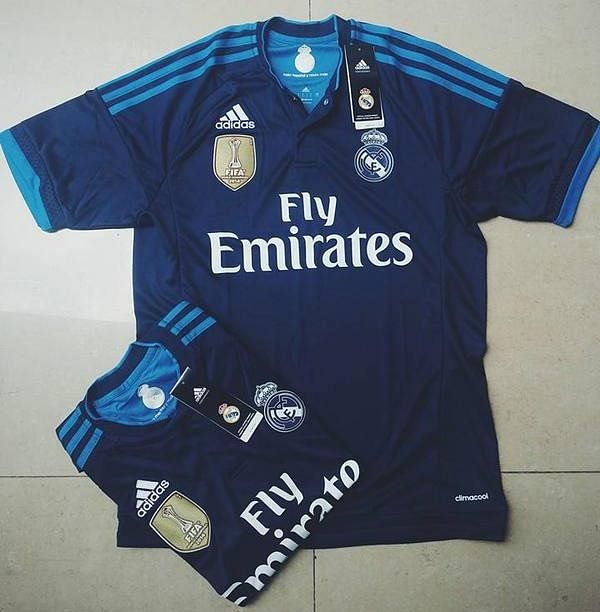
The image size is (600, 612). What are the coordinates of `greyish, white tile background` in the screenshot? It's located at (292, 606).